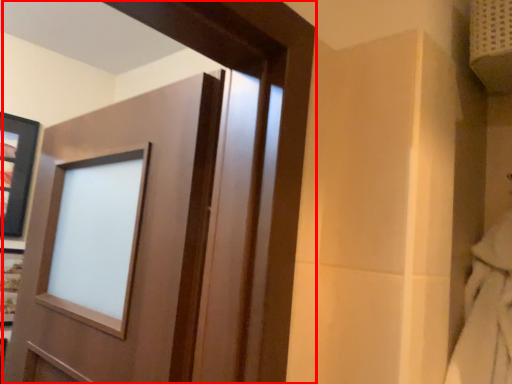
Question: From the image's perspective, considering the relative positions of door (annotated by the red box) and picture frame in the image provided, where is door (annotated by the red box) located with respect to the staircase?

Choices:
 (A) above
 (B) below

Answer: (B)